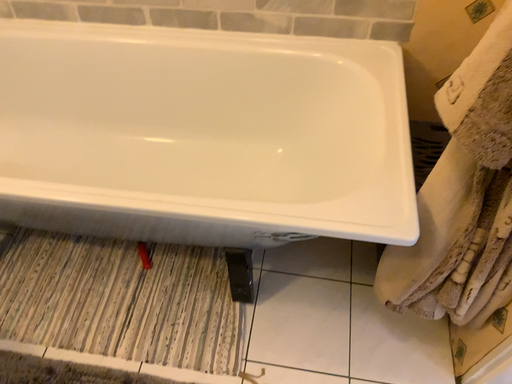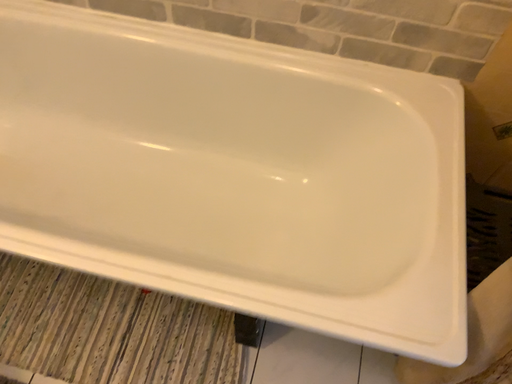
Question: How did the camera likely rotate when shooting the video?

Choices:
 (A) rotated downward
 (B) rotated upward

Answer: (A)